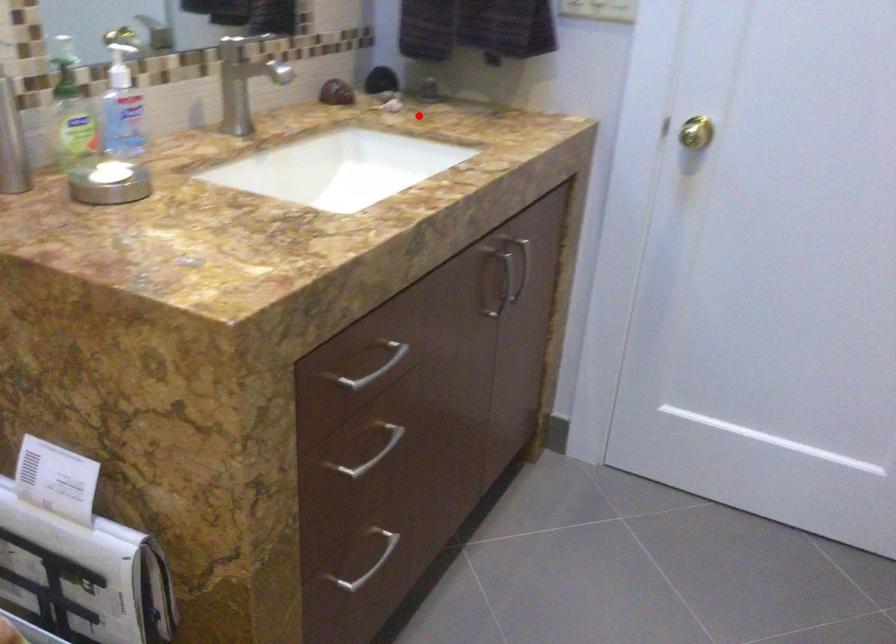
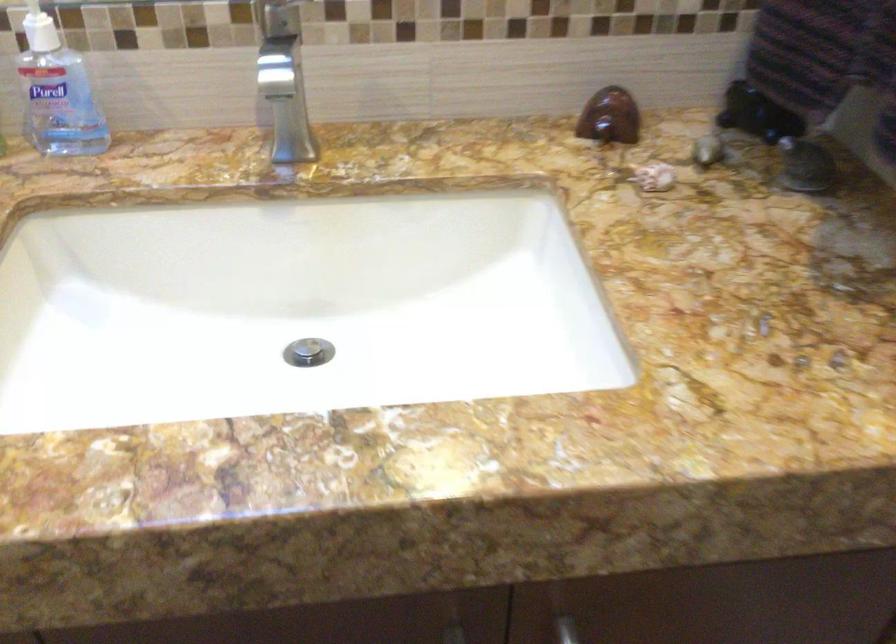
In the second image, find the point that corresponds to the highlighted location in the first image.

(708, 149)